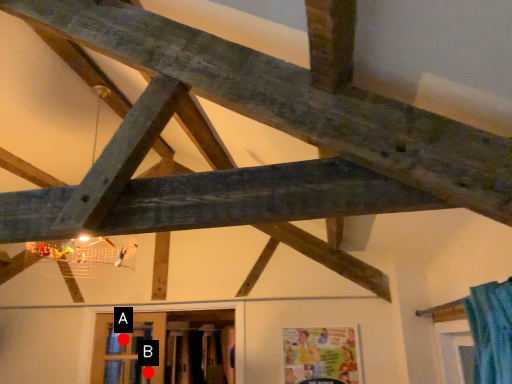
Question: Two points are circled on the image, labeled by A and B beside each circle. Which of the following is the closest to the observer?

Choices:
 (A) A is closer
 (B) B is closer

Answer: (B)